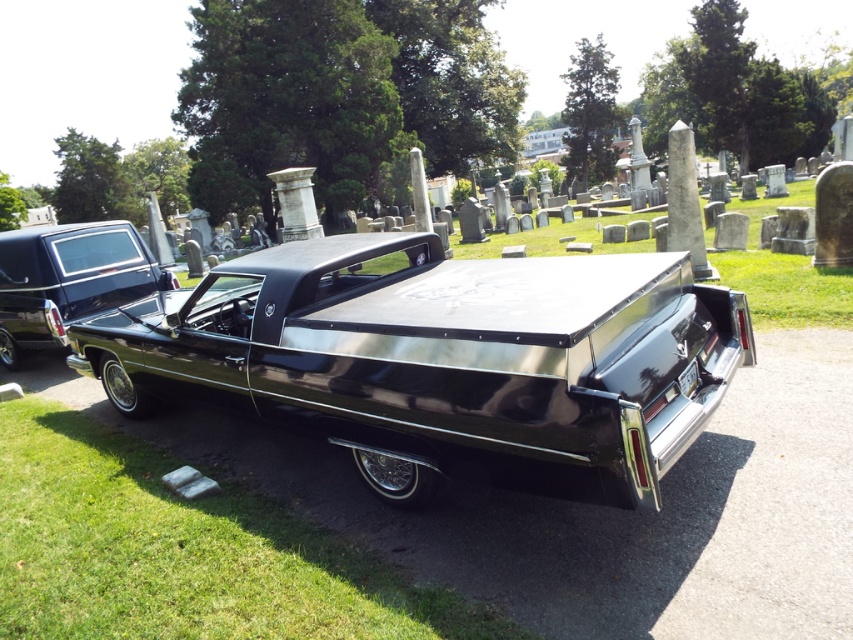
Is glossy black car at center positioned in front of green grass at lower left?

Yes, glossy black car at center is closer to the viewer.

Does glossy black car at center appear under green grass at lower left?

No, glossy black car at center is not below green grass at lower left.

Locate an element on the screen. The width and height of the screenshot is (853, 640). glossy black car at center is located at coordinates point(447,358).

Which is below, green grass at lower left or glossy black car at left?

green grass at lower left is lower down.

Find the location of a particular element. The height and width of the screenshot is (640, 853). green grass at lower left is located at coordinates coord(183,552).

Which is in front, point (109, 380) or point (27, 307)?

Point (109, 380) is in front.

Who is positioned more to the left, glossy black car at center or glossy black car at left?

Positioned to the left is glossy black car at left.

Locate an element on the screen. The width and height of the screenshot is (853, 640). glossy black car at center is located at coordinates (447, 358).

Locate an element on the screen. The height and width of the screenshot is (640, 853). glossy black car at center is located at coordinates (447, 358).